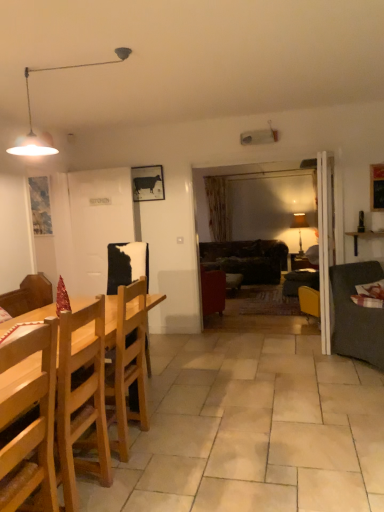
Image resolution: width=384 pixels, height=512 pixels. I want to click on unoccupied region to the right of light brown wooden chair at left, the first chair when ordered from back to front, so click(x=178, y=445).